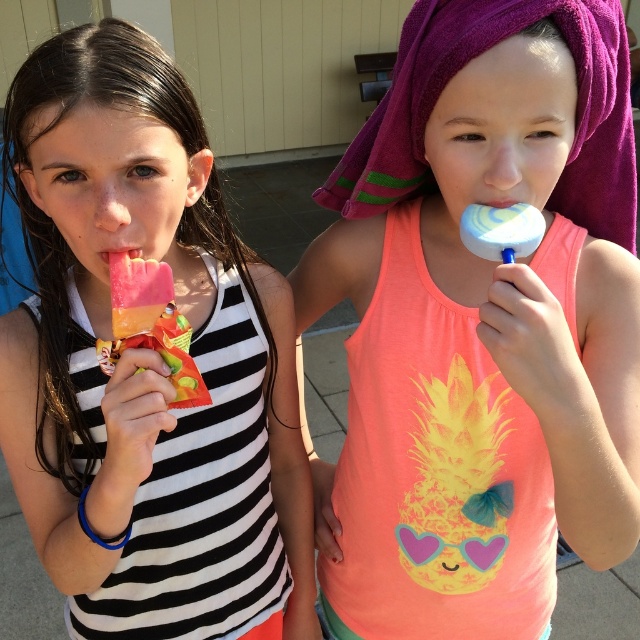
Question: Does pink matte popsicle at left appear on the left side of matte plastic popsicle at left?

Choices:
 (A) no
 (B) yes

Answer: (B)

Question: Can you confirm if matte blue lollipop at center is positioned below pink matte lollipop at center?

Choices:
 (A) yes
 (B) no

Answer: (A)

Question: Does matte plastic popsicle at left have a larger size compared to pink matte lollipop at center?

Choices:
 (A) no
 (B) yes

Answer: (B)

Question: Which object appears closest to the camera in this image?

Choices:
 (A) pink matte lollipop at center
 (B) matte plastic popsicle at left
 (C) pink matte popsicle at left

Answer: (C)

Question: Which point is closer to the camera taking this photo?

Choices:
 (A) (108, 259)
 (B) (179, 356)
 (C) (486, 438)

Answer: (A)

Question: Which point appears farthest from the camera in this image?

Choices:
 (A) (132, 326)
 (B) (483, 442)

Answer: (B)